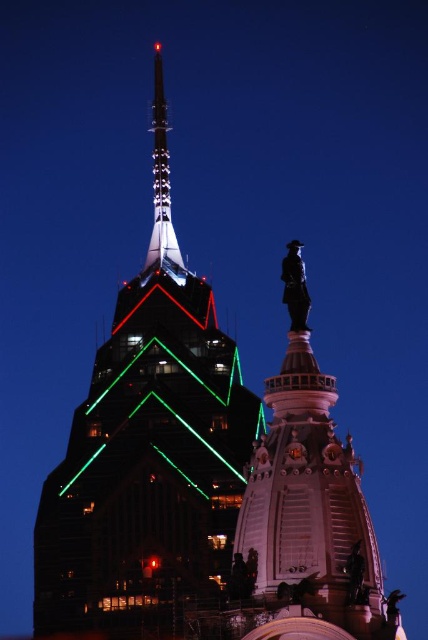
What do you see at coordinates (309, 502) in the screenshot?
I see `polished bronze statue at center` at bounding box center [309, 502].

Does polished bronze statue at center have a lesser height compared to shiny metallic spire at upper center?

Correct, polished bronze statue at center is not as tall as shiny metallic spire at upper center.

Between point (365, 608) and point (154, 236), which one is positioned behind?

The point (154, 236) is behind.

You are a GUI agent. You are given a task and a screenshot of the screen. Output one action in this format:
    pyautogui.click(x=<x>, y=<y>)
    Task: Click on the polished bronze statue at center
    This screenshot has width=428, height=640.
    Given the screenshot: What is the action you would take?
    pyautogui.click(x=309, y=502)

Is metallic glass skyscraper at center to the right of polished bronze statue at center from the viewer's perspective?

Incorrect, metallic glass skyscraper at center is not on the right side of polished bronze statue at center.

Can you confirm if metallic glass skyscraper at center is positioned below polished bronze statue at center?

Actually, metallic glass skyscraper at center is above polished bronze statue at center.

Does point (83, 442) come behind point (326, 493)?

Yes.

Locate an element on the screen. This screenshot has height=640, width=428. metallic glass skyscraper at center is located at coordinates (148, 451).

Is metallic glass skyscraper at center thinner than shiny metallic spire at upper center?

No, metallic glass skyscraper at center is not thinner than shiny metallic spire at upper center.

Can you confirm if metallic glass skyscraper at center is positioned to the right of shiny metallic spire at upper center?

In fact, metallic glass skyscraper at center is to the left of shiny metallic spire at upper center.

The width and height of the screenshot is (428, 640). I want to click on metallic glass skyscraper at center, so click(x=148, y=451).

This screenshot has width=428, height=640. Identify the location of metallic glass skyscraper at center. (148, 451).